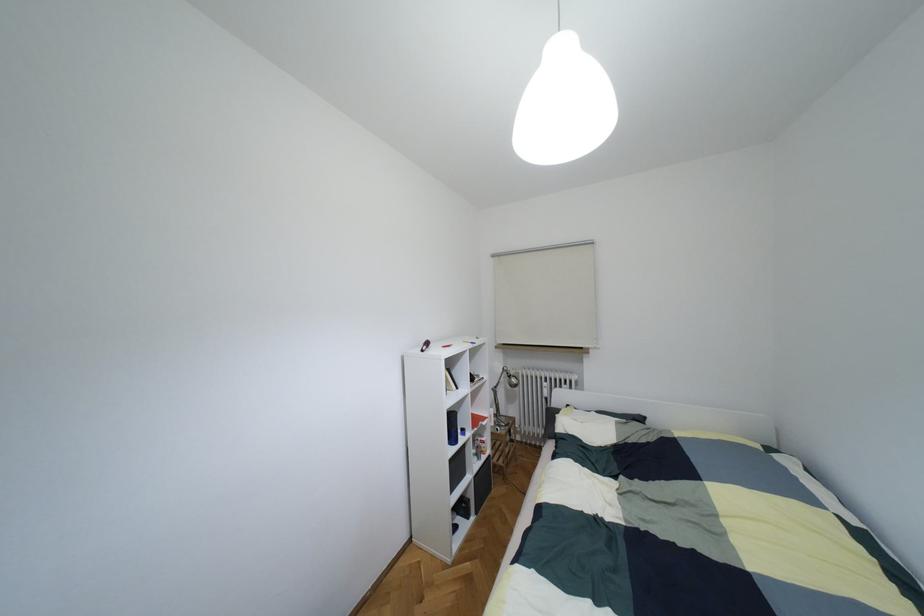
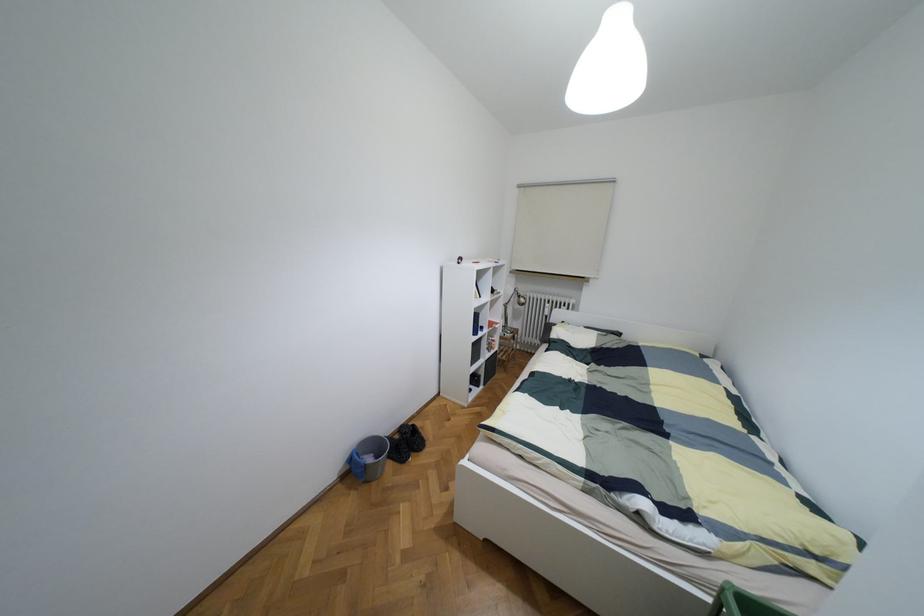
Locate, in the second image, the point that corresponds to the point at 508,376 in the first image.

(517, 296)